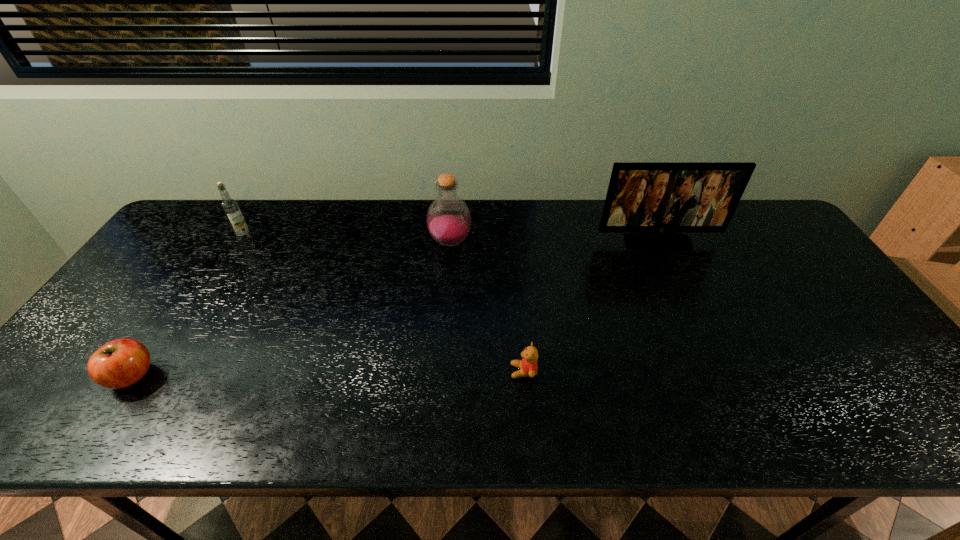
This screenshot has height=540, width=960. Identify the location of vacant region located on the right of the apple. (176, 375).

The height and width of the screenshot is (540, 960). What are the coordinates of `free location located 0.270m on the front-facing side of the teddy bear` in the screenshot? It's located at (395, 372).

Locate an element on the screen. The height and width of the screenshot is (540, 960). free space located on the front-facing side of the teddy bear is located at coordinates (425, 372).

Where is `vacant space located on the front-facing side of the teddy bear`? The image size is (960, 540). vacant space located on the front-facing side of the teddy bear is located at coordinates (361, 372).

Identify the location of monitor that is at the far edge. click(x=659, y=199).

Locate an element on the screen. The width and height of the screenshot is (960, 540). bottle present at the far edge is located at coordinates (448, 218).

Locate an element on the screen. vodka present at the far edge is located at coordinates (230, 207).

Locate an element on the screen. The image size is (960, 540). object situated at the left edge is located at coordinates (120, 363).

Where is `free space at the far edge of the desktop`? free space at the far edge of the desktop is located at coordinates (566, 227).

In the image, there is a desktop. Where is `vacant space at the near edge`? The width and height of the screenshot is (960, 540). vacant space at the near edge is located at coordinates (362, 418).